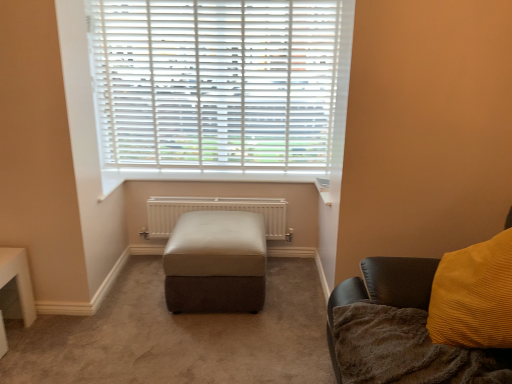
Question: Does white metallic radiator at center have a greater width compared to white plastic blinds at upper center?

Choices:
 (A) no
 (B) yes

Answer: (B)

Question: From a real-world perspective, is white metallic radiator at center physically below white plastic blinds at upper center?

Choices:
 (A) no
 (B) yes

Answer: (B)

Question: Are white metallic radiator at center and white plastic blinds at upper center far apart?

Choices:
 (A) yes
 (B) no

Answer: (B)

Question: Is white metallic radiator at center outside white plastic blinds at upper center?

Choices:
 (A) no
 (B) yes

Answer: (B)

Question: Does white metallic radiator at center have a smaller size compared to white plastic blinds at upper center?

Choices:
 (A) yes
 (B) no

Answer: (A)

Question: From the image's perspective, would you say white metallic radiator at center is shown under white plastic blinds at upper center?

Choices:
 (A) yes
 (B) no

Answer: (A)

Question: Are white plastic blinds at upper center and velvet mustard pillow at right far apart?

Choices:
 (A) no
 (B) yes

Answer: (B)

Question: From the image's perspective, is white plastic blinds at upper center located above velvet mustard pillow at right?

Choices:
 (A) no
 (B) yes

Answer: (B)

Question: From a real-world perspective, does white plastic blinds at upper center sit lower than velvet mustard pillow at right?

Choices:
 (A) yes
 (B) no

Answer: (B)

Question: Considering the relative sizes of white plastic blinds at upper center and velvet mustard pillow at right in the image provided, is white plastic blinds at upper center wider than velvet mustard pillow at right?

Choices:
 (A) yes
 (B) no

Answer: (B)

Question: From a real-world perspective, is white plastic blinds at upper center positioned over velvet mustard pillow at right based on gravity?

Choices:
 (A) no
 (B) yes

Answer: (B)

Question: Does white plastic blinds at upper center come in front of velvet mustard pillow at right?

Choices:
 (A) no
 (B) yes

Answer: (A)

Question: Can you confirm if brown fuzzy blanket at lower right is bigger than leather ottoman at center?

Choices:
 (A) no
 (B) yes

Answer: (A)